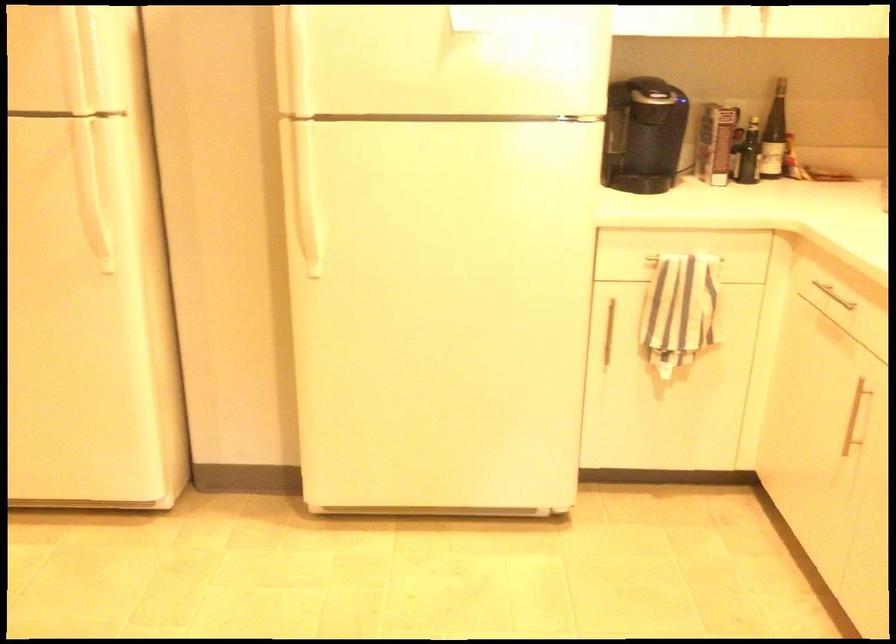
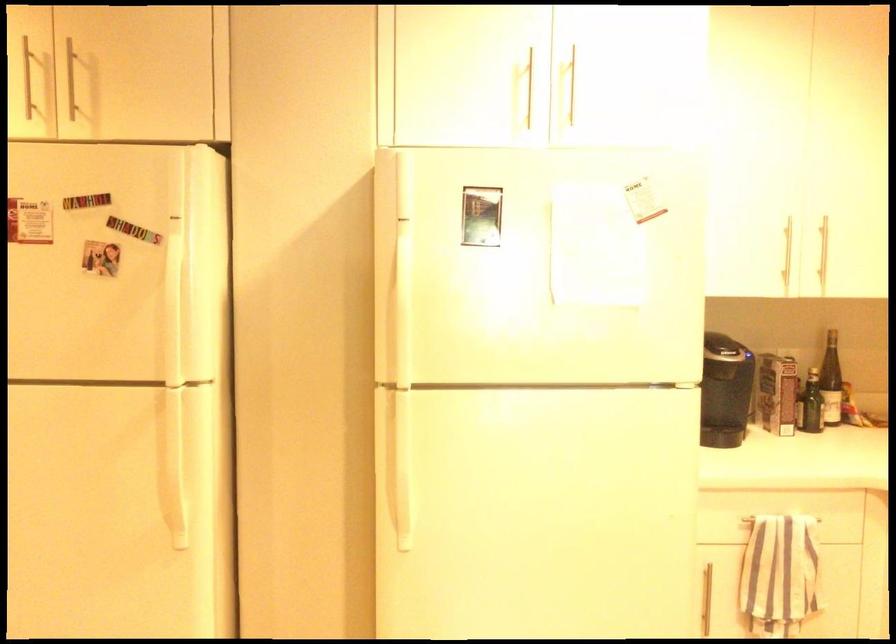
Find the pixel in the second image that matches pixel 299 187 in the first image.

(398, 460)